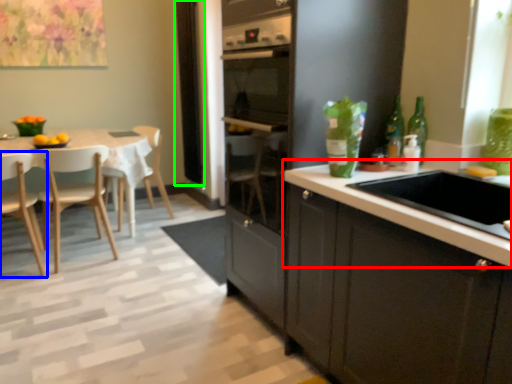
Question: Estimate the real-world distances between objects in this image. Which object is closer to countertop (highlighted by a red box), chair (highlighted by a blue box) or window screen (highlighted by a green box)?

Choices:
 (A) chair
 (B) window screen

Answer: (A)